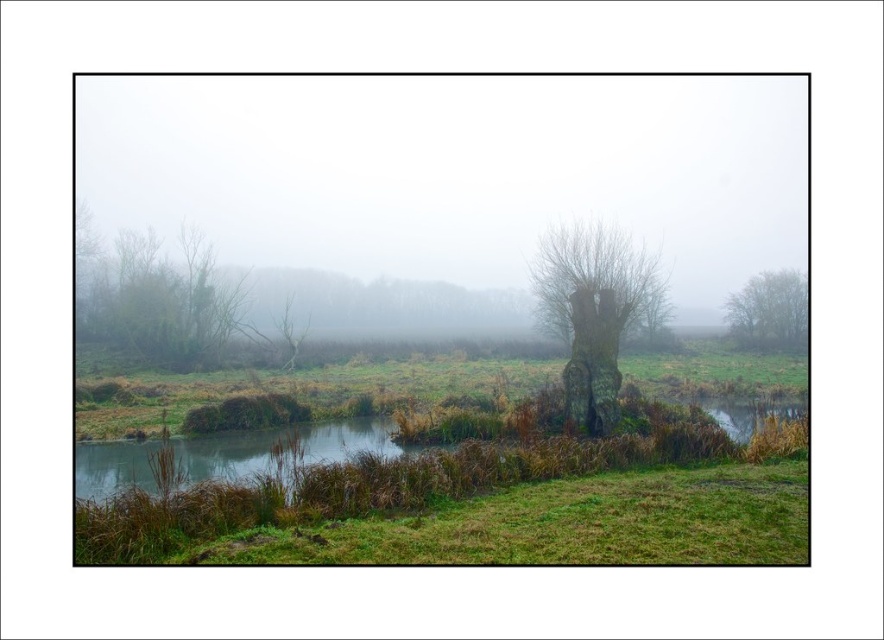
You are an artist sketching the landscape. You notice the green matte tree at left and the bare branches at center. Which one appears higher in the drawing?

The green matte tree at left appears higher in the drawing because it is positioned above the bare branches at center.